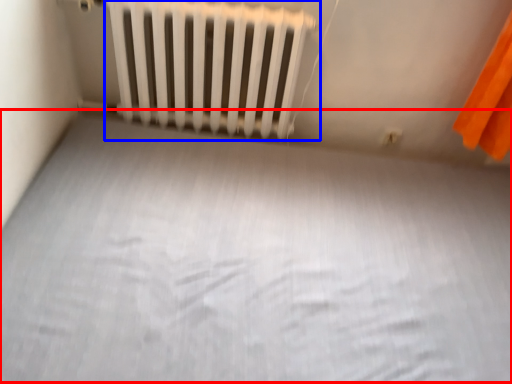
Question: Which object appears farthest to the camera in this image, bed frame (highlighted by a red box) or radiator (highlighted by a blue box)?

Choices:
 (A) bed frame
 (B) radiator

Answer: (B)